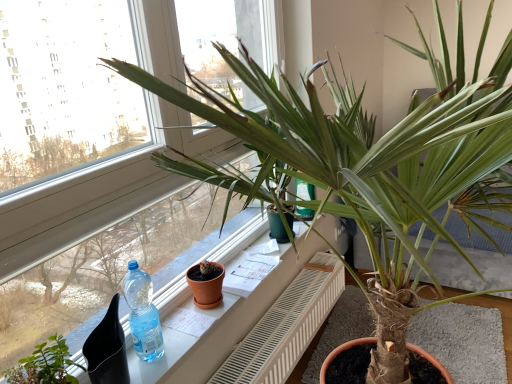
Question: Is green matte plant at lower left thinner than transparent plastic bottle at window?

Choices:
 (A) yes
 (B) no

Answer: (B)

Question: Could you tell me if green matte plant at lower left is facing transparent plastic bottle at window?

Choices:
 (A) no
 (B) yes

Answer: (A)

Question: Is transparent plastic bottle at window located within green matte plant at lower left?

Choices:
 (A) no
 (B) yes

Answer: (A)

Question: Is green matte plant at lower left in contact with transparent plastic bottle at window?

Choices:
 (A) no
 (B) yes

Answer: (A)

Question: Can you confirm if green matte plant at lower left is positioned to the left of transparent plastic bottle at window?

Choices:
 (A) yes
 (B) no

Answer: (A)

Question: Considering the positions of green leafy plant at upper center and white plastic radiator at center in the image, is green leafy plant at upper center taller or shorter than white plastic radiator at center?

Choices:
 (A) tall
 (B) short

Answer: (A)

Question: From the image's perspective, relative to white plastic radiator at center, is green leafy plant at upper center above or below?

Choices:
 (A) above
 (B) below

Answer: (A)

Question: Is green leafy plant at upper center situated inside white plastic radiator at center or outside?

Choices:
 (A) inside
 (B) outside

Answer: (B)

Question: Relative to white plastic radiator at center, is green leafy plant at upper center in front or behind?

Choices:
 (A) behind
 (B) front

Answer: (B)

Question: In the image, is white plastic radiator at center on the left side or the right side of white glossy window sill at center?

Choices:
 (A) left
 (B) right

Answer: (B)

Question: Relative to white glossy window sill at center, is white plastic radiator at center in front or behind?

Choices:
 (A) front
 (B) behind

Answer: (B)

Question: Considering the positions of white plastic radiator at center and white glossy window sill at center in the image, is white plastic radiator at center taller or shorter than white glossy window sill at center?

Choices:
 (A) short
 (B) tall

Answer: (B)

Question: From a real-world perspective, relative to white glossy window sill at center, is white plastic radiator at center vertically above or below?

Choices:
 (A) above
 (B) below

Answer: (B)

Question: Is transparent plastic bottle at window taller or shorter than terracotta clay pot at center?

Choices:
 (A) tall
 (B) short

Answer: (A)

Question: Looking at their shapes, would you say transparent plastic bottle at window is wider or thinner than terracotta clay pot at center?

Choices:
 (A) wide
 (B) thin

Answer: (B)